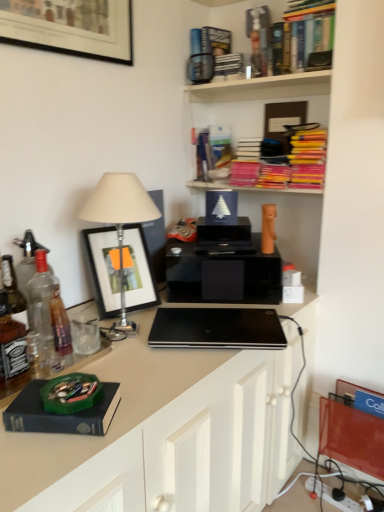
Identify the location of blank space situated above dark blue matte book at lower left (from a real-world perspective). (53, 399).